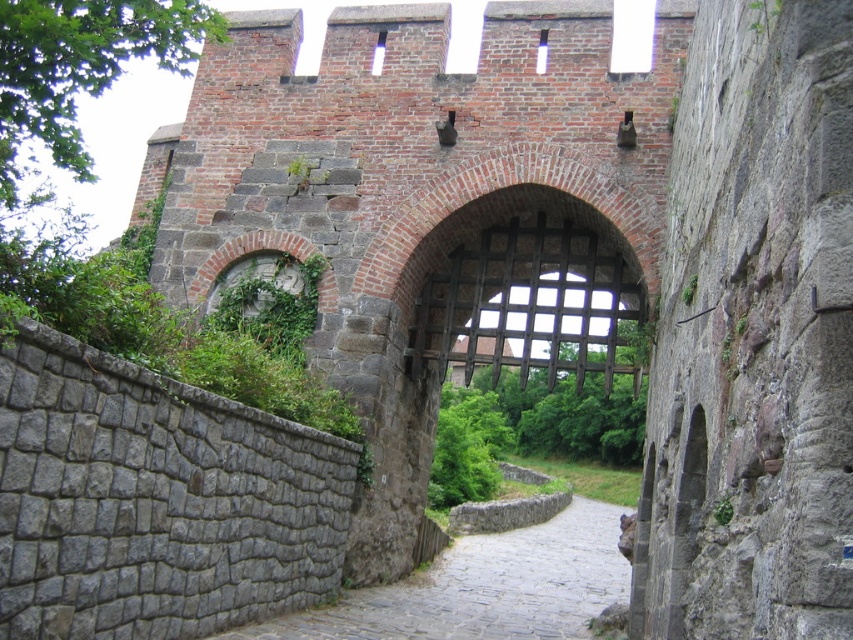
Question: Which point appears closest to the camera in this image?

Choices:
 (A) (439, 636)
 (B) (380, 51)
 (C) (538, 33)

Answer: (A)

Question: Can you confirm if transparent glass window at upper center is thinner than transparent glass window at center?

Choices:
 (A) yes
 (B) no

Answer: (B)

Question: Which point appears closest to the camera in this image?

Choices:
 (A) (372, 58)
 (B) (540, 51)
 (C) (445, 637)

Answer: (C)

Question: Is gray cobblestone path at center smaller than transparent glass window at upper center?

Choices:
 (A) no
 (B) yes

Answer: (A)

Question: Among these objects, which one is farthest from the camera?

Choices:
 (A) transparent glass window at center
 (B) transparent glass window at upper center
 (C) gray cobblestone path at center

Answer: (B)

Question: From the image, what is the correct spatial relationship of transparent glass window at upper center in relation to transparent glass window at center?

Choices:
 (A) left
 (B) right

Answer: (A)